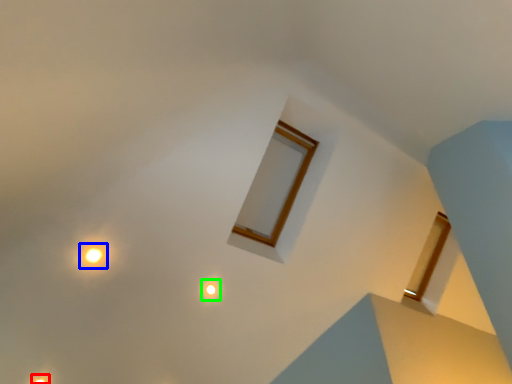
Question: Based on their relative distances, which object is farther from light (highlighted by a red box)? Choose from light (highlighted by a blue box) and light (highlighted by a green box).

Choices:
 (A) light
 (B) light

Answer: (B)